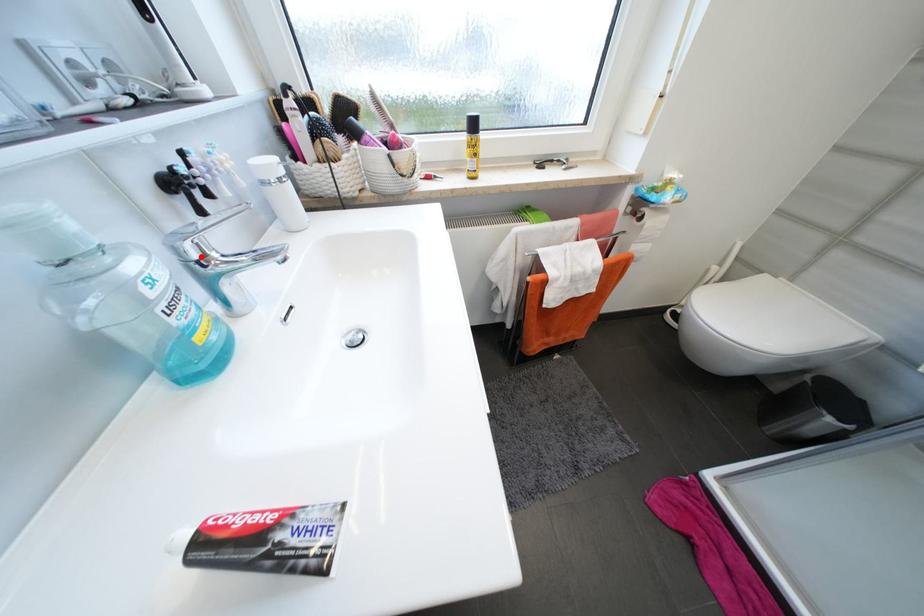
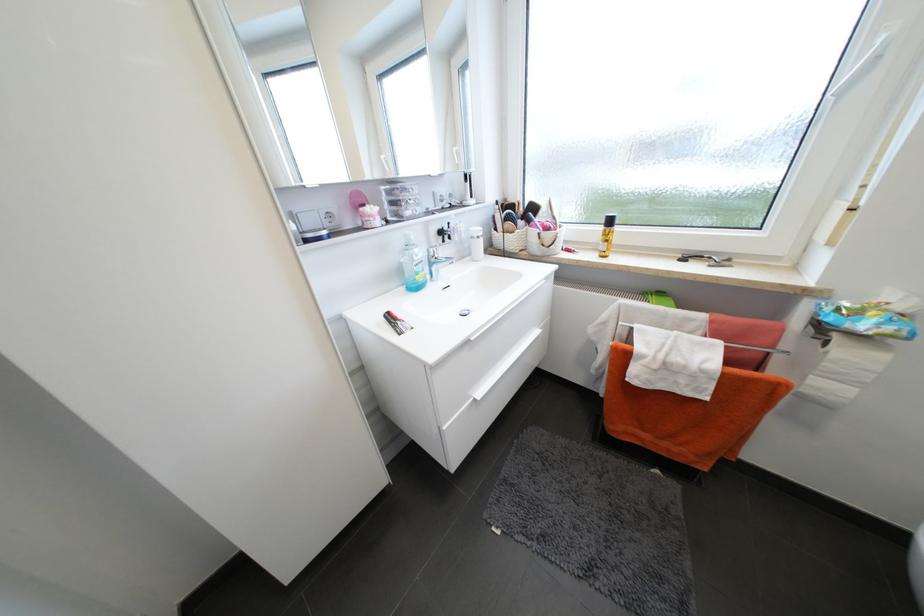
Locate, in the second image, the point that corresponds to the highlighted location in the first image.

(438, 254)